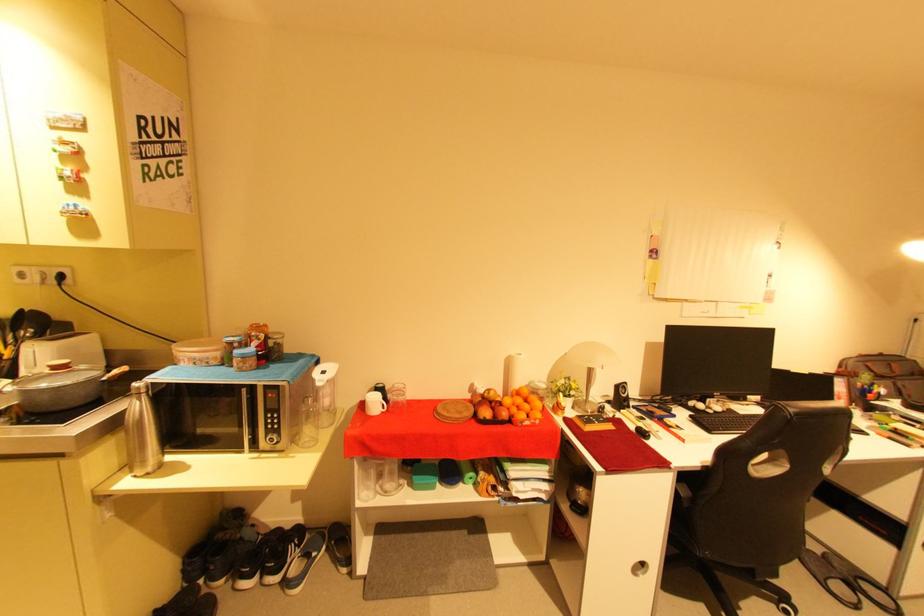
Find where to resting arm the chair armrest. Please return your answer as a coordinate pair (x, y).

(681, 511)